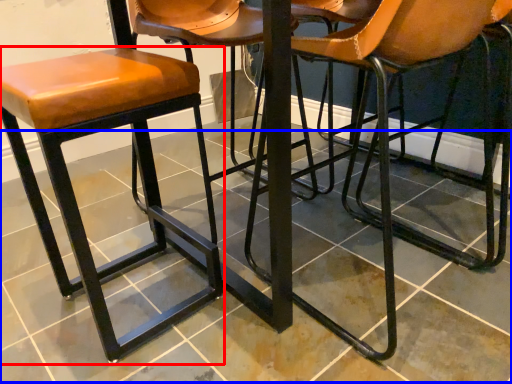
Question: Among these objects, which one is farthest to the camera, stool (highlighted by a red box) or tile (highlighted by a blue box)?

Choices:
 (A) stool
 (B) tile

Answer: (A)